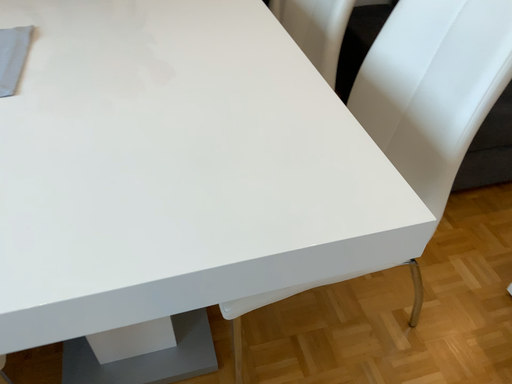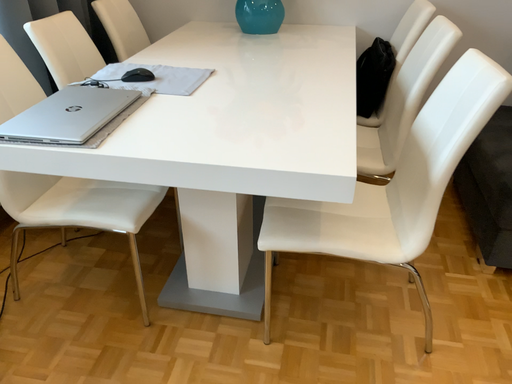
Question: How did the camera likely rotate when shooting the video?

Choices:
 (A) rotated downward
 (B) rotated upward

Answer: (B)